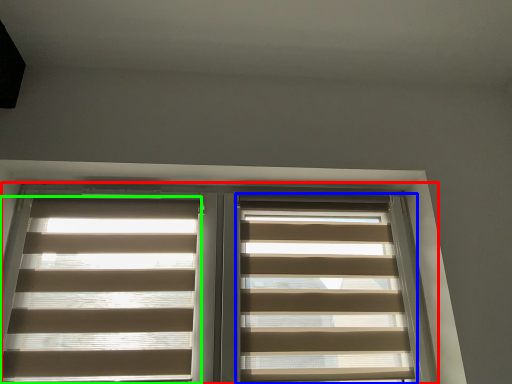
Question: Based on their relative distances, which object is farther from window (highlighted by a red box)? Choose from window blind (highlighted by a blue box) and window blind (highlighted by a green box).

Choices:
 (A) window blind
 (B) window blind

Answer: (A)